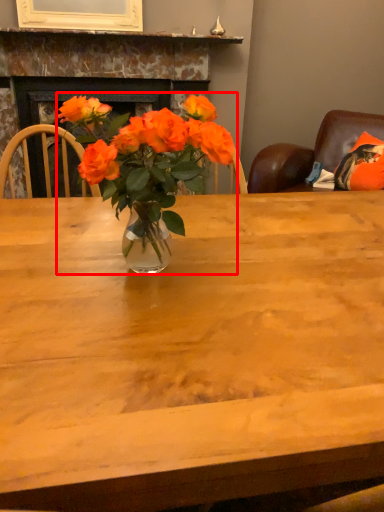
Question: From the image's perspective, where is houseplant (annotated by the red box) located in relation to fireplace in the image?

Choices:
 (A) above
 (B) below

Answer: (B)